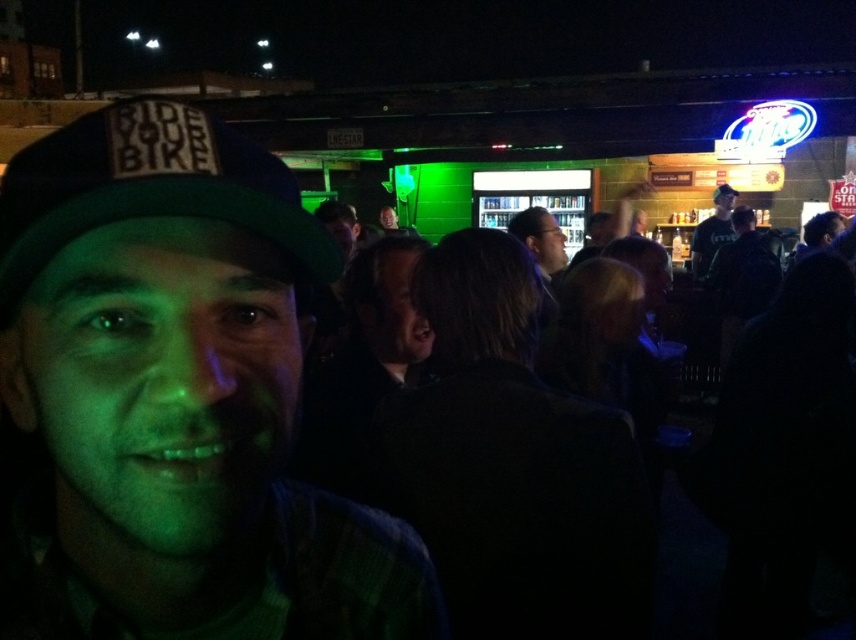
You are at a bar and see two people wearing dark clothing at center and dark blue shirt at center. Which one is more to the left?

The dark clothing at center is more to the left side of dark blue shirt at center.